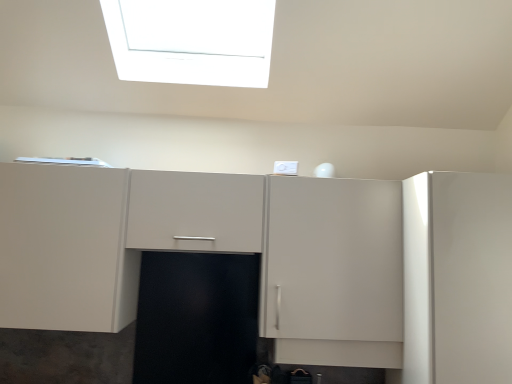
In order to face matte white cabinet at center, which appears as the 2th cabinetry when viewed from the right, should I rotate leftwards or rightwards?

You should rotate left by 9.910 degrees.

Identify the location of matte white cabinet at center, which appears as the 2th cabinetry when viewed from the right. The height and width of the screenshot is (384, 512). (276, 259).

The width and height of the screenshot is (512, 384). Describe the element at coordinates (276, 259) in the screenshot. I see `matte white cabinet at center, which appears as the 2th cabinetry when viewed from the right` at that location.

Locate an element on the screen. The image size is (512, 384). glossy white cabinet at right, the second cabinetry from the left is located at coordinates (457, 278).

What is the approximate height of glossy white cabinet at right, the 1th cabinetry positioned from the right?

The height of glossy white cabinet at right, the 1th cabinetry positioned from the right, is 3.30 feet.

What do you see at coordinates (457, 278) in the screenshot? This screenshot has width=512, height=384. I see `glossy white cabinet at right, the 1th cabinetry positioned from the right` at bounding box center [457, 278].

Find the location of `matte white cabinet at center, which appears as the 2th cabinetry when viewed from the right`. matte white cabinet at center, which appears as the 2th cabinetry when viewed from the right is located at coordinates (276, 259).

Does glossy white cabinet at right, the 1th cabinetry positioned from the right, appear on the left side of matte white cabinet at center, which appears as the 2th cabinetry when viewed from the right?

In fact, glossy white cabinet at right, the 1th cabinetry positioned from the right, is to the right of matte white cabinet at center, which appears as the 2th cabinetry when viewed from the right.

Is glossy white cabinet at right, the 1th cabinetry positioned from the right, in front of or behind matte white cabinet at center, the first cabinetry from the left, in the image?

Visually, glossy white cabinet at right, the 1th cabinetry positioned from the right, is located in front of matte white cabinet at center, the first cabinetry from the left.

Does point (511, 195) appear closer or farther from the camera than point (509, 231)?

Clearly, point (511, 195) is more distant from the camera than point (509, 231).

From the image's perspective, would you say glossy white cabinet at right, the second cabinetry from the left, is shown under matte white cabinet at center, the first cabinetry from the left?

Yes, from the image's perspective, glossy white cabinet at right, the second cabinetry from the left, is beneath matte white cabinet at center, the first cabinetry from the left.

From a real-world perspective, does glossy white cabinet at right, the 1th cabinetry positioned from the right, sit lower than matte white cabinet at center, which appears as the 2th cabinetry when viewed from the right?

Yes, from a real-world perspective, glossy white cabinet at right, the 1th cabinetry positioned from the right, is below matte white cabinet at center, which appears as the 2th cabinetry when viewed from the right.

Considering the sizes of glossy white cabinet at right, the 1th cabinetry positioned from the right, and matte white cabinet at center, which appears as the 2th cabinetry when viewed from the right, in the image, is glossy white cabinet at right, the 1th cabinetry positioned from the right, wider or thinner than matte white cabinet at center, which appears as the 2th cabinetry when viewed from the right,?

Considering their sizes, glossy white cabinet at right, the 1th cabinetry positioned from the right, looks broader than matte white cabinet at center, which appears as the 2th cabinetry when viewed from the right.

Between glossy white cabinet at right, the second cabinetry from the left, and matte white cabinet at center, the first cabinetry from the left, which one has less height?

Standing shorter between the two is matte white cabinet at center, the first cabinetry from the left.

Looking at the image, does glossy white cabinet at right, the second cabinetry from the left, seem bigger or smaller compared to matte white cabinet at center, which appears as the 2th cabinetry when viewed from the right?

In the image, glossy white cabinet at right, the second cabinetry from the left, appears to be smaller than matte white cabinet at center, which appears as the 2th cabinetry when viewed from the right.

Do you think glossy white cabinet at right, the 1th cabinetry positioned from the right, is within matte white cabinet at center, the first cabinetry from the left, or outside of it?

glossy white cabinet at right, the 1th cabinetry positioned from the right, is located beyond the bounds of matte white cabinet at center, the first cabinetry from the left.

Is the surface of glossy white cabinet at right, the 1th cabinetry positioned from the right, in direct contact with matte white cabinet at center, which appears as the 2th cabinetry when viewed from the right?

No, glossy white cabinet at right, the 1th cabinetry positioned from the right, is not making contact with matte white cabinet at center, which appears as the 2th cabinetry when viewed from the right.

Is glossy white cabinet at right, the second cabinetry from the left, positioned with its back to matte white cabinet at center, which appears as the 2th cabinetry when viewed from the right?

glossy white cabinet at right, the second cabinetry from the left, does not have its back to matte white cabinet at center, which appears as the 2th cabinetry when viewed from the right.

How different are the orientations of glossy white cabinet at right, the second cabinetry from the left, and matte white cabinet at center, which appears as the 2th cabinetry when viewed from the right, in degrees?

They differ by 1.32 degrees in their facing directions.

How much distance is there between glossy white cabinet at right, the second cabinetry from the left, and matte white cabinet at center, which appears as the 2th cabinetry when viewed from the right?

glossy white cabinet at right, the second cabinetry from the left, is 10.87 inches from matte white cabinet at center, which appears as the 2th cabinetry when viewed from the right.

You are a GUI agent. You are given a task and a screenshot of the screen. Output one action in this format:
    pyautogui.click(x=<x>, y=<y>)
    Task: Click on the cabinetry positioned vertically above the glossy white cabinet at right, the 1th cabinetry positioned from the right (from a real-world perspective)
    
    Given the screenshot: What is the action you would take?
    tap(276, 259)

Considering the positions of objects matte white cabinet at center, the first cabinetry from the left, and glossy white cabinet at right, the second cabinetry from the left, in the image provided, who is more to the right, matte white cabinet at center, the first cabinetry from the left, or glossy white cabinet at right, the second cabinetry from the left,?

Positioned to the right is glossy white cabinet at right, the second cabinetry from the left.

Does matte white cabinet at center, which appears as the 2th cabinetry when viewed from the right, lie behind glossy white cabinet at right, the 1th cabinetry positioned from the right?

Yes.

Which is farther from the camera, (186,226) or (426,196)?

The point (186,226) is farther.

From the image's perspective, is matte white cabinet at center, which appears as the 2th cabinetry when viewed from the right, over glossy white cabinet at right, the second cabinetry from the left?

Yes, from the image's perspective, matte white cabinet at center, which appears as the 2th cabinetry when viewed from the right, is over glossy white cabinet at right, the second cabinetry from the left.

From a real-world perspective, is matte white cabinet at center, the first cabinetry from the left, physically above glossy white cabinet at right, the second cabinetry from the left?

Yes.

Can you confirm if matte white cabinet at center, the first cabinetry from the left, is thinner than glossy white cabinet at right, the 1th cabinetry positioned from the right?

Yes, matte white cabinet at center, the first cabinetry from the left, is thinner than glossy white cabinet at right, the 1th cabinetry positioned from the right.

Which of these two, matte white cabinet at center, which appears as the 2th cabinetry when viewed from the right, or glossy white cabinet at right, the 1th cabinetry positioned from the right, stands shorter?

Standing shorter between the two is matte white cabinet at center, which appears as the 2th cabinetry when viewed from the right.

Who is bigger, matte white cabinet at center, which appears as the 2th cabinetry when viewed from the right, or glossy white cabinet at right, the 1th cabinetry positioned from the right?

Bigger between the two is matte white cabinet at center, which appears as the 2th cabinetry when viewed from the right.

Is matte white cabinet at center, the first cabinetry from the left, not within glossy white cabinet at right, the second cabinetry from the left?

matte white cabinet at center, the first cabinetry from the left, lies outside glossy white cabinet at right, the second cabinetry from the left,'s area.

Is matte white cabinet at center, which appears as the 2th cabinetry when viewed from the right, placed right next to glossy white cabinet at right, the 1th cabinetry positioned from the right?

They are not placed beside each other.

Is matte white cabinet at center, the first cabinetry from the left, facing away from glossy white cabinet at right, the 1th cabinetry positioned from the right?

matte white cabinet at center, the first cabinetry from the left, does not have its back to glossy white cabinet at right, the 1th cabinetry positioned from the right.

How far apart are matte white cabinet at center, the first cabinetry from the left, and glossy white cabinet at right, the second cabinetry from the left?

A distance of 10.87 inches exists between matte white cabinet at center, the first cabinetry from the left, and glossy white cabinet at right, the second cabinetry from the left.

Where is `cabinetry located on the right of matte white cabinet at center, the first cabinetry from the left`? cabinetry located on the right of matte white cabinet at center, the first cabinetry from the left is located at coordinates [457, 278].

At what (x,y) coordinates should I click in order to perform the action: click on cabinetry located on the left of glossy white cabinet at right, the second cabinetry from the left. Please return your answer as a coordinate pair (x, y). The width and height of the screenshot is (512, 384). Looking at the image, I should click on (276, 259).

This screenshot has height=384, width=512. I want to click on cabinetry on the right of the matte white cabinet at center, the first cabinetry from the left, so click(x=457, y=278).